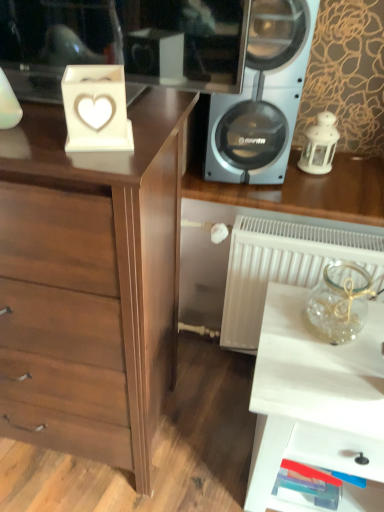
Where is `free space in front of white matte heart-shaped object at upper left`? This screenshot has height=512, width=384. free space in front of white matte heart-shaped object at upper left is located at coordinates click(87, 157).